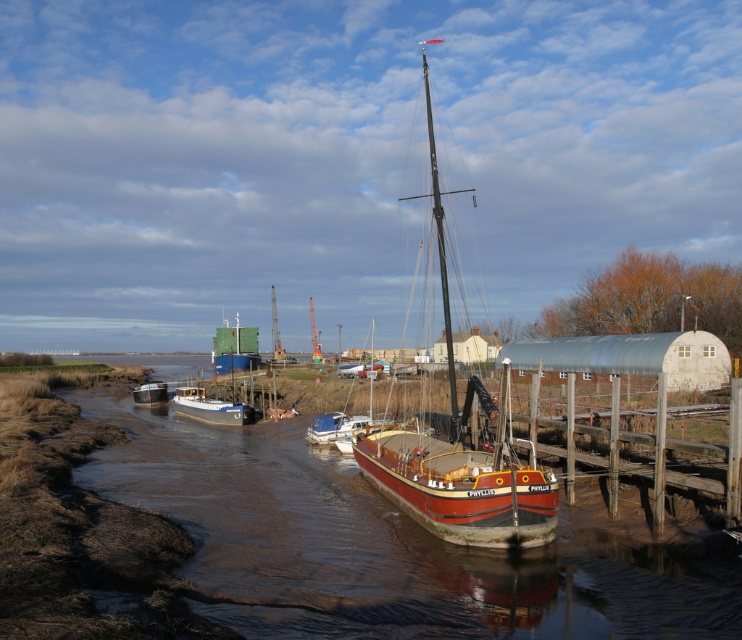
Consider the image. Does brown mud at lower left have a larger size compared to wooden sailboat at center?

No, brown mud at lower left is not bigger than wooden sailboat at center.

Does point (375, 566) lie behind point (485, 456)?

That is False.

What do you see at coordinates (381, 547) in the screenshot? I see `brown mud at lower left` at bounding box center [381, 547].

Locate an element on the screen. Image resolution: width=742 pixels, height=640 pixels. brown mud at lower left is located at coordinates (381, 547).

Between wooden sailboat at center and white plastic dinghy at center, which one appears on the left side from the viewer's perspective?

Positioned to the left is white plastic dinghy at center.

Is point (528, 547) closer to viewer compared to point (177, 404)?

Yes, point (528, 547) is in front of point (177, 404).

Image resolution: width=742 pixels, height=640 pixels. I want to click on wooden sailboat at center, so click(459, 451).

Is wooden sailboat at center bigger than metallic gray dock at center?

Yes.

Is wooden sailboat at center closer to camera compared to metallic gray dock at center?

That is False.

What are the coordinates of `wooden sailboat at center` in the screenshot? It's located at (459, 451).